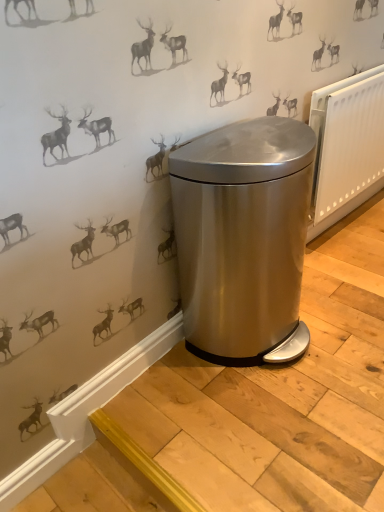
This screenshot has height=512, width=384. Find the location of `vacant space that's between satin silver trash can at center and white plastic radiator at right`. vacant space that's between satin silver trash can at center and white plastic radiator at right is located at coordinates (340, 270).